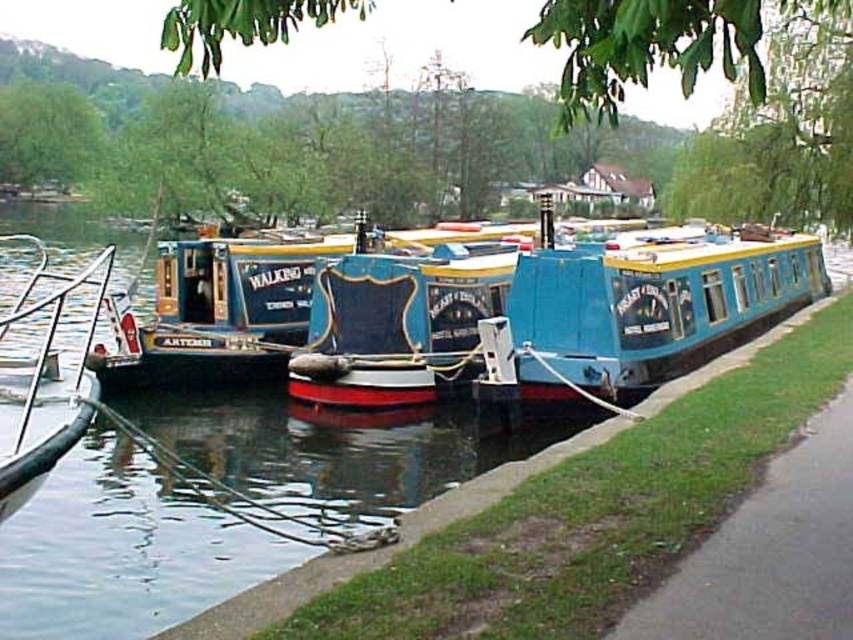
You are a visitor planning to board the blue matte houseboat at center and the metallic silver boat at left. Based on their heights, which boat would require you to climb higher to board?

The blue matte houseboat at center is much taller than the metallic silver boat at left, so you would need to climb higher to board the blue matte houseboat at center.